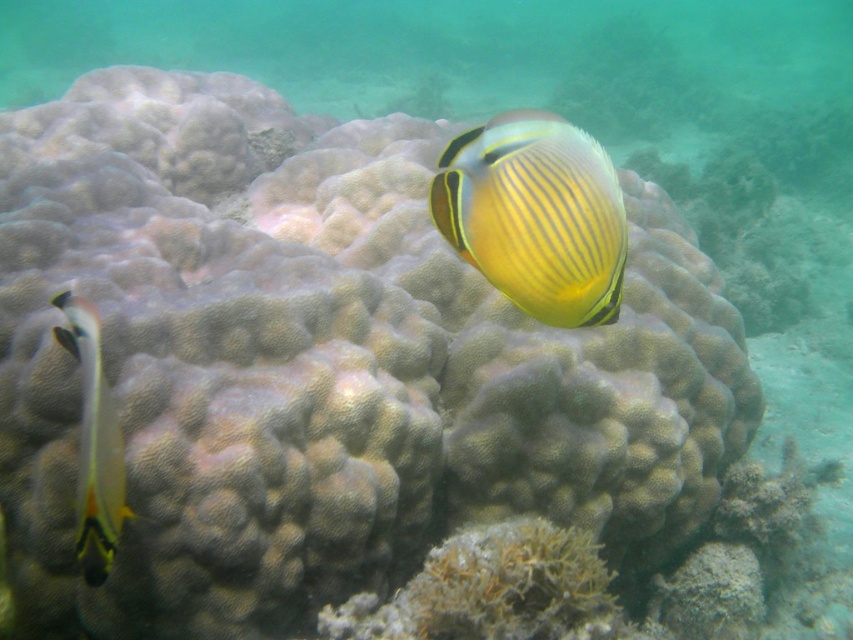
You are a scuba diver observing the underwater scene. You see the yellow striped fish at center and the translucent yellow and black fish at left. Which fish is closer to you?

The yellow striped fish at center is closer to you because the translucent yellow and black fish at left is behind it.

You are a scuba diver trying to locate two points underwater. The first point is at coordinates point (614,184) and the second is at point (83,406). Which point is closer to you?

Point (614,184) is further to the viewer than point (83,406), so the second point is closer to you.

You are a marine biologist observing underwater life. You notice a point marked at coordinates point (x=454, y=237). If you want to collect a sample from this point, and your sampling tool has a maximum reach of 3 feet, will you be able to reach it?

The point (x=454, y=237) is 3.58 feet away from the camera, which exceeds the sampling tool maximum reach of 3 feet. Therefore, you cannot reach it.